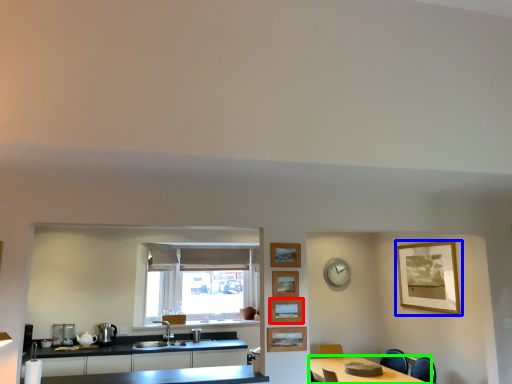
Question: Estimate the real-world distances between objects in this image. Which object is farther from picture frame (highlighted by a red box), picture frame (highlighted by a blue box) or table (highlighted by a green box)?

Choices:
 (A) picture frame
 (B) table

Answer: (A)